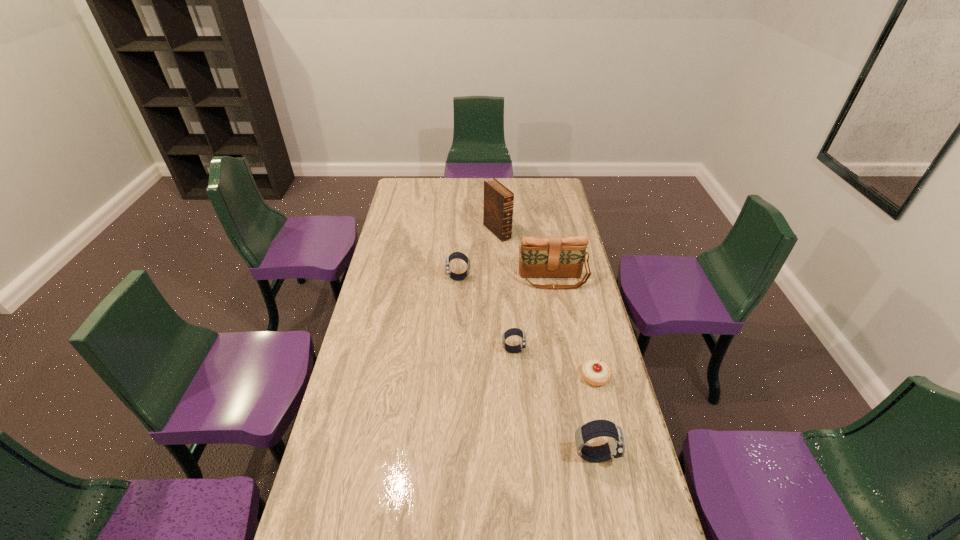
Identify the location of watch that stands as the closest to the shoulder bag. (456, 255).

Identify the location of blank area in the image that satisfies the following two spatial constraints: 1. on the face of the fifth farthest object; 2. on the left side of the second shortest object. (516, 377).

Locate an element on the screen. Image resolution: width=960 pixels, height=540 pixels. vacant space that satisfies the following two spatial constraints: 1. on the front-facing side of the second tallest object; 2. on the face of the shortest watch is located at coordinates (565, 350).

Locate an element on the screen. vacant region that satisfies the following two spatial constraints: 1. on the face of the shortest watch; 2. on the right side of the pastry is located at coordinates (516, 377).

Where is `blank space that satisfies the following two spatial constraints: 1. on the face of the third shortest object; 2. on the right side of the pastry`? The image size is (960, 540). blank space that satisfies the following two spatial constraints: 1. on the face of the third shortest object; 2. on the right side of the pastry is located at coordinates (452, 377).

Locate an element on the screen. vacant area in the image that satisfies the following two spatial constraints: 1. on the face of the shortest object; 2. on the left side of the second shortest watch is located at coordinates (452, 377).

Find the location of a particular element. The height and width of the screenshot is (540, 960). vacant region that satisfies the following two spatial constraints: 1. on the face of the shortest watch; 2. on the back side of the shortest object is located at coordinates (516, 377).